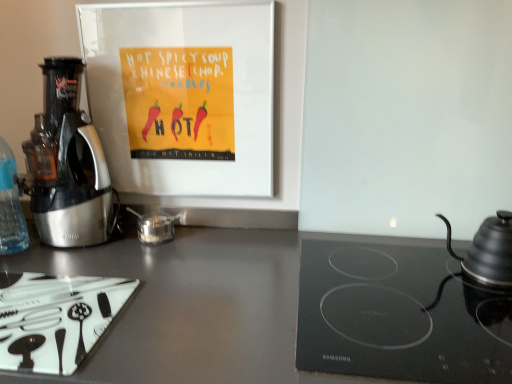
Measure the distance between metallic silver coffee maker at left and camera.

metallic silver coffee maker at left is 3.31 feet from camera.

Identify the location of transparent plastic bottle at left. The width and height of the screenshot is (512, 384). [x=10, y=206].

The height and width of the screenshot is (384, 512). Describe the element at coordinates (10, 206) in the screenshot. I see `transparent plastic bottle at left` at that location.

What do you see at coordinates (155, 227) in the screenshot? I see `transparent glass tea pot at center` at bounding box center [155, 227].

Locate an element on the screen. black matte kettle at right, which is the 2th kitchen appliance in left-to-right order is located at coordinates (488, 251).

From the picture: Is the position of transparent glass tea pot at center less distant than that of white glossy cutting board at lower left, marked as the first kitchen appliance in a left-to-right arrangement?

No, transparent glass tea pot at center is further to the viewer.

Can you confirm if transparent glass tea pot at center is wider than white glossy cutting board at lower left, the second kitchen appliance viewed from the right?

In fact, transparent glass tea pot at center might be narrower than white glossy cutting board at lower left, the second kitchen appliance viewed from the right.

Would you say transparent glass tea pot at center is a long distance from white glossy cutting board at lower left, the second kitchen appliance viewed from the right?

No, transparent glass tea pot at center is not far from white glossy cutting board at lower left, the second kitchen appliance viewed from the right.

Is black matte kettle at right, the first kitchen appliance from the right, at the back of transparent plastic bottle at left?

No, black matte kettle at right, the first kitchen appliance from the right, is not at the back of transparent plastic bottle at left.

Based on their sizes in the image, would you say transparent plastic bottle at left is bigger or smaller than black matte kettle at right, which is the 2th kitchen appliance in left-to-right order?

Clearly, transparent plastic bottle at left is smaller in size than black matte kettle at right, which is the 2th kitchen appliance in left-to-right order.

Is transparent plastic bottle at left not near black matte kettle at right, the first kitchen appliance from the right?

Yes, transparent plastic bottle at left and black matte kettle at right, the first kitchen appliance from the right, are quite far apart.

How many degrees apart are the facing directions of transparent plastic bottle at left and black matte kettle at right, the first kitchen appliance from the right?

transparent plastic bottle at left and black matte kettle at right, the first kitchen appliance from the right, are facing 1.77 degrees away from each other.

From the image's perspective, is matte gray countertop at center beneath transparent glass tea pot at center?

Yes, from the image's perspective, matte gray countertop at center is below transparent glass tea pot at center.

Could you tell me if matte gray countertop at center is facing transparent glass tea pot at center?

No, matte gray countertop at center does not turn towards transparent glass tea pot at center.

From a real-world perspective, relative to transparent glass tea pot at center, is matte gray countertop at center vertically above or below?

matte gray countertop at center is below transparent glass tea pot at center.

Is black glass cooktop at lower right positioned with its back to black matte kettle at right, which is the 2th kitchen appliance in left-to-right order?

That's not correct — black glass cooktop at lower right is not looking away from black matte kettle at right, which is the 2th kitchen appliance in left-to-right order.

From a real-world perspective, who is located higher, black glass cooktop at lower right or black matte kettle at right, the first kitchen appliance from the right?

black matte kettle at right, the first kitchen appliance from the right, from a real-world perspective.

Which of these two, black matte kettle at right, the first kitchen appliance from the right, or black glass cooktop at lower right, is thinner?

black matte kettle at right, the first kitchen appliance from the right.

Would you say black matte kettle at right, the first kitchen appliance from the right, is outside black glass cooktop at lower right?

Indeed, black matte kettle at right, the first kitchen appliance from the right, is completely outside black glass cooktop at lower right.

Does black matte kettle at right, which is the 2th kitchen appliance in left-to-right order, turn towards black glass cooktop at lower right?

No, black matte kettle at right, which is the 2th kitchen appliance in left-to-right order, is not oriented towards black glass cooktop at lower right.

From the image's perspective, starting from the transparent plastic bottle at left, which kitchen appliance is the 1st one below? Please provide its 2D coordinates.

[(488, 251)]

Is black matte kettle at right, which is the 2th kitchen appliance in left-to-right order, positioned beyond the bounds of transparent plastic bottle at left?

black matte kettle at right, which is the 2th kitchen appliance in left-to-right order, lies outside transparent plastic bottle at left's area.

Measure the distance from black matte kettle at right, the first kitchen appliance from the right, to transparent plastic bottle at left.

The distance of black matte kettle at right, the first kitchen appliance from the right, from transparent plastic bottle at left is 1.14 meters.

Which of these two, black matte kettle at right, which is the 2th kitchen appliance in left-to-right order, or transparent plastic bottle at left, is thinner?

Thinner between the two is transparent plastic bottle at left.

From the image's perspective, between metallic silver coffee maker at left and white glossy cutting board at lower left, marked as the first kitchen appliance in a left-to-right arrangement, who is located below?

white glossy cutting board at lower left, marked as the first kitchen appliance in a left-to-right arrangement.

How different are the orientations of metallic silver coffee maker at left and white glossy cutting board at lower left, the second kitchen appliance viewed from the right, in degrees?

0.00206 degrees separate the facing orientations of metallic silver coffee maker at left and white glossy cutting board at lower left, the second kitchen appliance viewed from the right.

Would you say metallic silver coffee maker at left is to the left or to the right of white glossy cutting board at lower left, the second kitchen appliance viewed from the right, in the picture?

In the image, metallic silver coffee maker at left appears on the left side of white glossy cutting board at lower left, the second kitchen appliance viewed from the right.

From a real-world perspective, is metallic silver coffee maker at left located higher than white glossy cutting board at lower left, the second kitchen appliance viewed from the right?

Yes, from a real-world perspective, metallic silver coffee maker at left is on top of white glossy cutting board at lower left, the second kitchen appliance viewed from the right.

The height and width of the screenshot is (384, 512). Identify the location of kitchen appliance on the left of transparent glass tea pot at center. (56, 320).

Image resolution: width=512 pixels, height=384 pixels. In order to click on bottle above the black matte kettle at right, the first kitchen appliance from the right (from the image's perspective) in this screenshot , I will do `click(10, 206)`.

Which object lies further to the anchor point black glass cooktop at lower right, transparent glass tea pot at center or black matte kettle at right, which is the 2th kitchen appliance in left-to-right order?

transparent glass tea pot at center.

Which object lies further to the anchor point transparent plastic bottle at left, matte gray countertop at center or black glass cooktop at lower right?

Based on the image, black glass cooktop at lower right appears to be further to transparent plastic bottle at left.

Based on their spatial positions, is metallic silver coffee maker at left or white glossy cutting board at lower left, marked as the first kitchen appliance in a left-to-right arrangement, further from matte gray countertop at center?

metallic silver coffee maker at left.

Estimate the real-world distances between objects in this image. Which object is further from white glossy cutting board at lower left, the second kitchen appliance viewed from the right, black matte kettle at right, the first kitchen appliance from the right, or transparent glass tea pot at center?

Among the two, black matte kettle at right, the first kitchen appliance from the right, is located further to white glossy cutting board at lower left, the second kitchen appliance viewed from the right.

From the image, which object appears to be farther from white glossy cutting board at lower left, the second kitchen appliance viewed from the right, black glass cooktop at lower right or transparent glass tea pot at center?

black glass cooktop at lower right lies further to white glossy cutting board at lower left, the second kitchen appliance viewed from the right, than the other object.

Looking at the image, which one is located closer to black glass cooktop at lower right, metallic silver coffee maker at left or transparent glass tea pot at center?

transparent glass tea pot at center is closer to black glass cooktop at lower right.

Which object lies nearer to the anchor point black glass cooktop at lower right, white glossy cutting board at lower left, the second kitchen appliance viewed from the right, or transparent glass tea pot at center?

white glossy cutting board at lower left, the second kitchen appliance viewed from the right, lies closer to black glass cooktop at lower right than the other object.

Considering their positions, is white glossy cutting board at lower left, marked as the first kitchen appliance in a left-to-right arrangement, positioned further to transparent plastic bottle at left than transparent glass tea pot at center?

Among the two, white glossy cutting board at lower left, marked as the first kitchen appliance in a left-to-right arrangement, is located further to transparent plastic bottle at left.

The image size is (512, 384). Find the location of `tea pot between transparent plastic bottle at left and matte gray countertop at center`. tea pot between transparent plastic bottle at left and matte gray countertop at center is located at coordinates (155, 227).

You are a GUI agent. You are given a task and a screenshot of the screen. Output one action in this format:
    pyautogui.click(x=<x>, y=<y>)
    Task: Click on the tea pot situated between white glossy cutting board at lower left, marked as the first kitchen appliance in a left-to-right arrangement, and black matte kettle at right, the first kitchen appliance from the right, from left to right
    
    Given the screenshot: What is the action you would take?
    pyautogui.click(x=155, y=227)

The width and height of the screenshot is (512, 384). What are the coordinates of `kitchen appliance between transparent plastic bottle at left and matte gray countertop at center in the horizontal direction` in the screenshot? It's located at (56, 320).

At what (x,y) coordinates should I click in order to perform the action: click on counter top located between metallic silver coffee maker at left and black glass cooktop at lower right in the left-right direction. Please return your answer as a coordinate pair (x, y). Looking at the image, I should click on (282, 311).